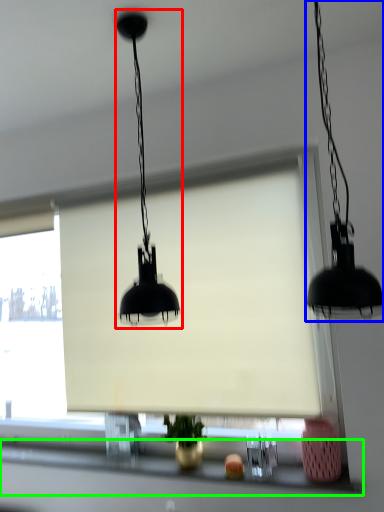
Question: Which object is positioned closest to lamp (highlighted by a red box)? Select from lamp (highlighted by a blue box) and window sill (highlighted by a green box).

Choices:
 (A) lamp
 (B) window sill

Answer: (A)